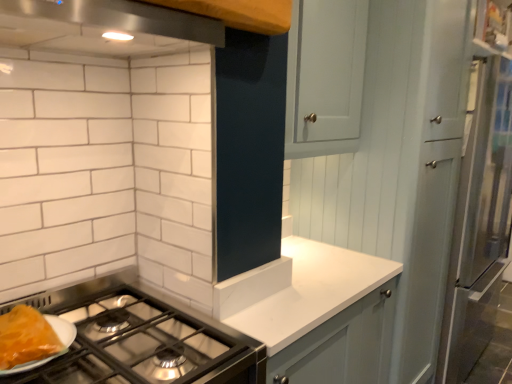
Question: Is stainless steel exhaust hood at upper center oriented away from shiny orange cheese at lower left?

Choices:
 (A) no
 (B) yes

Answer: (A)

Question: Considering the relative sizes of stainless steel exhaust hood at upper center and shiny orange cheese at lower left in the image provided, is stainless steel exhaust hood at upper center bigger than shiny orange cheese at lower left?

Choices:
 (A) yes
 (B) no

Answer: (A)

Question: Considering the relative positions of stainless steel exhaust hood at upper center and shiny orange cheese at lower left in the image provided, is stainless steel exhaust hood at upper center to the right of shiny orange cheese at lower left from the viewer's perspective?

Choices:
 (A) yes
 (B) no

Answer: (A)

Question: Does stainless steel exhaust hood at upper center turn towards shiny orange cheese at lower left?

Choices:
 (A) no
 (B) yes

Answer: (A)

Question: Would you say stainless steel exhaust hood at upper center is outside shiny orange cheese at lower left?

Choices:
 (A) yes
 (B) no

Answer: (A)

Question: Is white laminate countertop at center taller or shorter than stainless steel exhaust hood at upper center?

Choices:
 (A) tall
 (B) short

Answer: (A)

Question: Is white laminate countertop at center situated inside stainless steel exhaust hood at upper center or outside?

Choices:
 (A) outside
 (B) inside

Answer: (A)

Question: Does point (281, 296) appear closer or farther from the camera than point (47, 21)?

Choices:
 (A) farther
 (B) closer

Answer: (A)

Question: Would you say white laminate countertop at center is to the left or to the right of stainless steel exhaust hood at upper center in the picture?

Choices:
 (A) left
 (B) right

Answer: (B)

Question: Relative to white laminate countertop at center, is shiny orange cheese at lower left in front or behind?

Choices:
 (A) front
 (B) behind

Answer: (A)

Question: Is shiny orange cheese at lower left taller or shorter than white laminate countertop at center?

Choices:
 (A) tall
 (B) short

Answer: (B)

Question: Is shiny orange cheese at lower left situated inside white laminate countertop at center or outside?

Choices:
 (A) inside
 (B) outside

Answer: (B)

Question: From the image's perspective, is shiny orange cheese at lower left located above or below white laminate countertop at center?

Choices:
 (A) below
 (B) above

Answer: (B)

Question: Based on their sizes in the image, would you say stainless steel exhaust hood at upper center is bigger or smaller than white laminate countertop at center?

Choices:
 (A) small
 (B) big

Answer: (A)

Question: From a real-world perspective, relative to white laminate countertop at center, is stainless steel exhaust hood at upper center vertically above or below?

Choices:
 (A) below
 (B) above

Answer: (B)